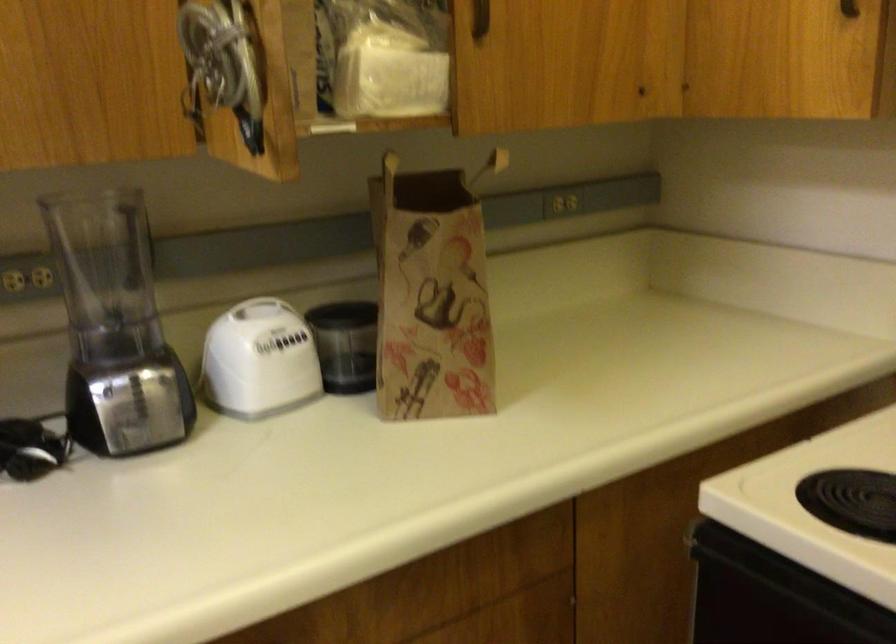
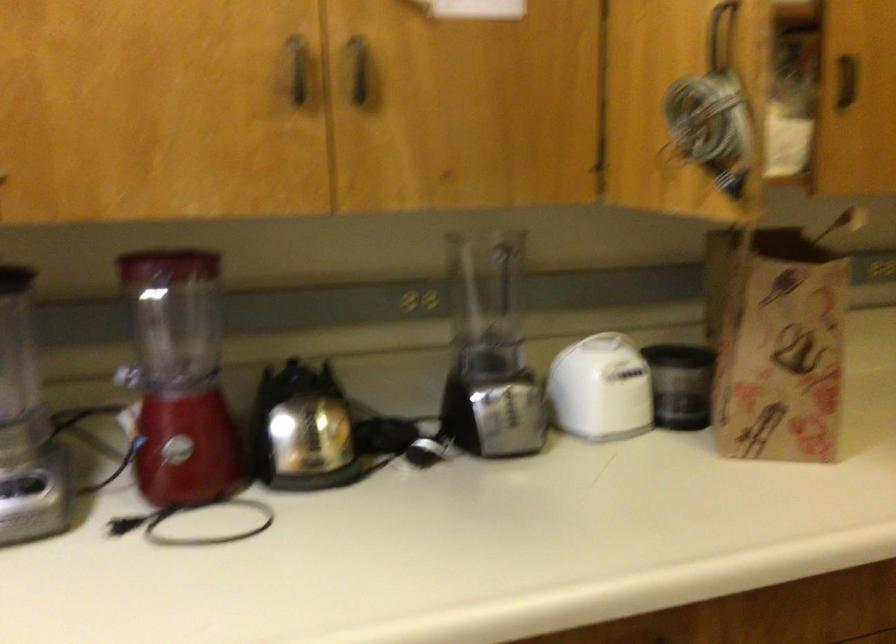
Question: The first image is from the beginning of the video and the second image is from the end. How did the camera likely rotate when shooting the video?

Choices:
 (A) Left
 (B) Right
 (C) Up
 (D) Down

Answer: (A)